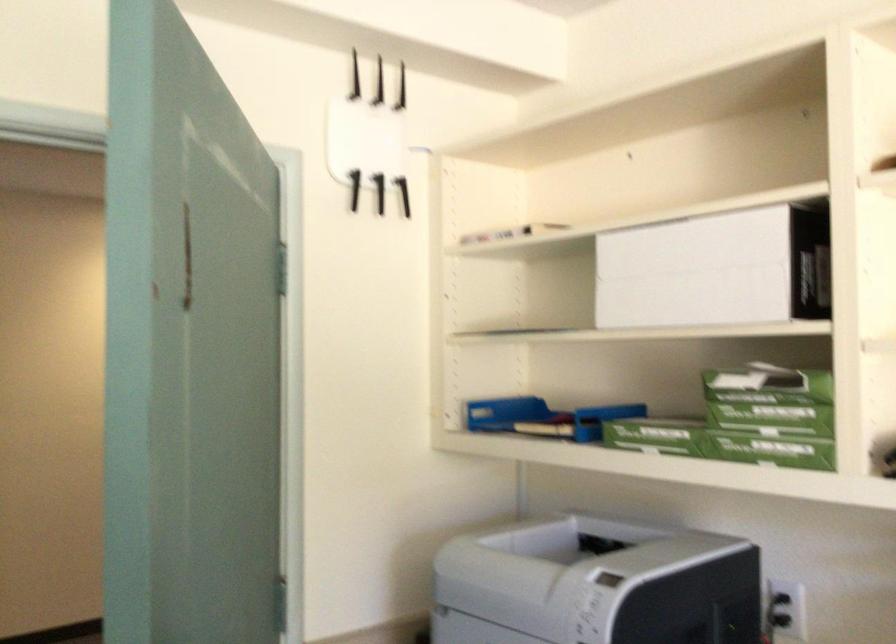
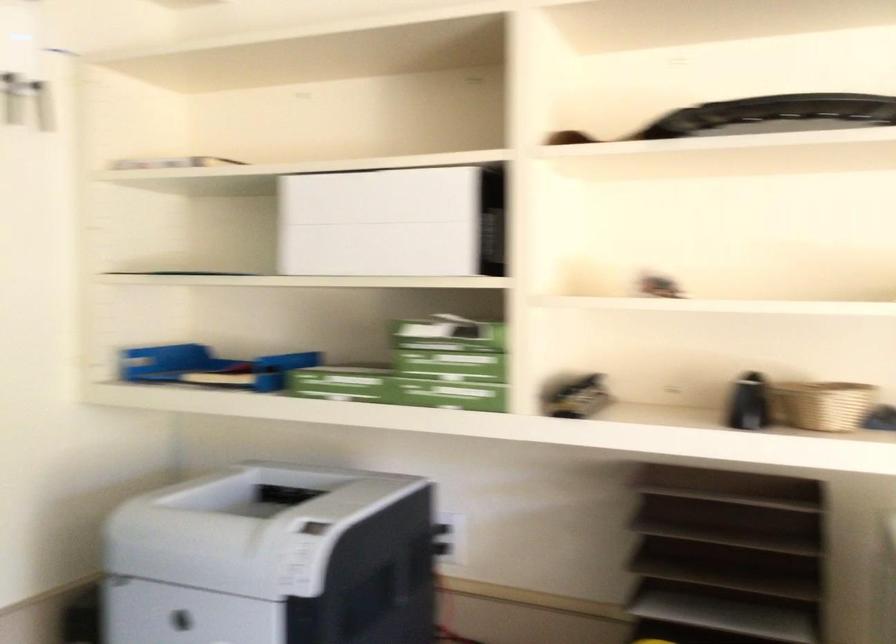
The point at (759, 390) is marked in the first image. Where is the corresponding point in the second image?

(446, 335)